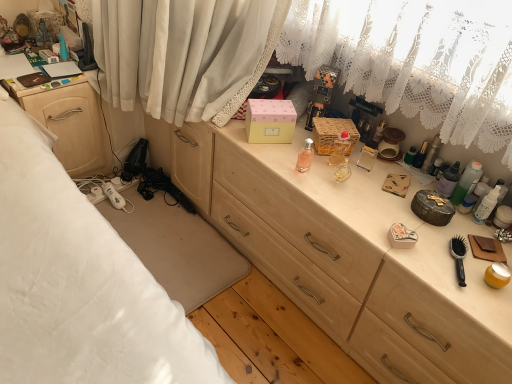
Locate an element on the screen. Image resolution: width=512 pixels, height=384 pixels. vacant point to the left of white glossy lotion at right, which ranks as the first toiletry in right-to-left order is located at coordinates (424, 218).